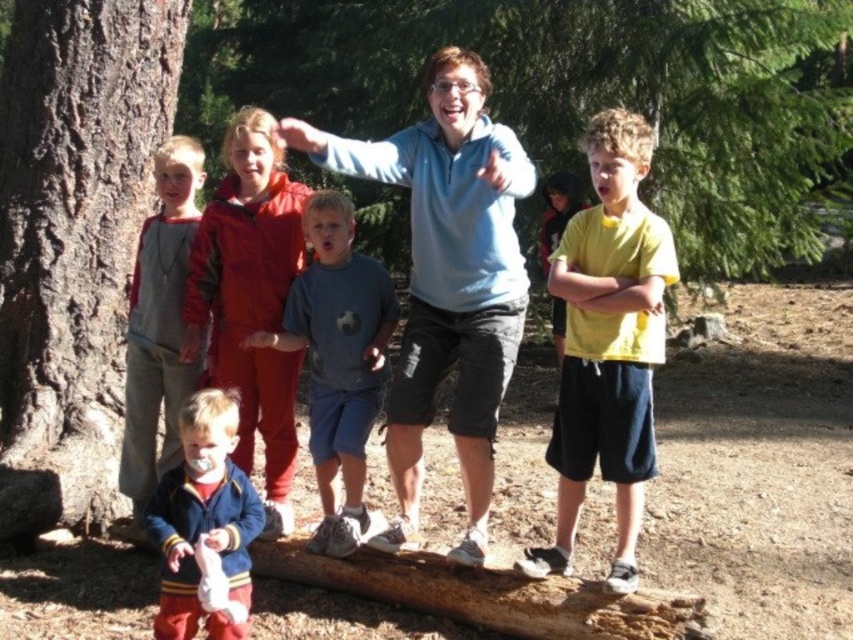
Does brown rough bark at left appear on the right side of velvet blue jacket at lower left?

Incorrect, brown rough bark at left is not on the right side of velvet blue jacket at lower left.

Does brown rough bark at left appear on the left side of velvet blue jacket at lower left?

Correct, you'll find brown rough bark at left to the left of velvet blue jacket at lower left.

At what (x,y) coordinates should I click in order to perform the action: click on brown rough bark at left. Please return your answer as a coordinate pair (x, y). This screenshot has height=640, width=853. Looking at the image, I should click on (73, 241).

Locate an element on the screen. brown rough bark at left is located at coordinates (73, 241).

From the picture: Between gray matte soccer ball at center and gray fleece jacket at left, which one has less height?

With less height is gray matte soccer ball at center.

Is point (343, 301) less distant than point (183, 189)?

Yes, point (343, 301) is in front of point (183, 189).

Between point (309, 353) and point (119, 484), which one is positioned behind?

Point (119, 484)

Find the location of a particular element. This screenshot has width=853, height=640. gray matte soccer ball at center is located at coordinates (338, 362).

Is point (270, 362) less distant than point (129, 436)?

Yes.

At what (x,y) coordinates should I click in order to perform the action: click on velvet blue jacket at center. Please return your answer as a coordinate pair (x, y). This screenshot has height=640, width=853. Looking at the image, I should click on (250, 298).